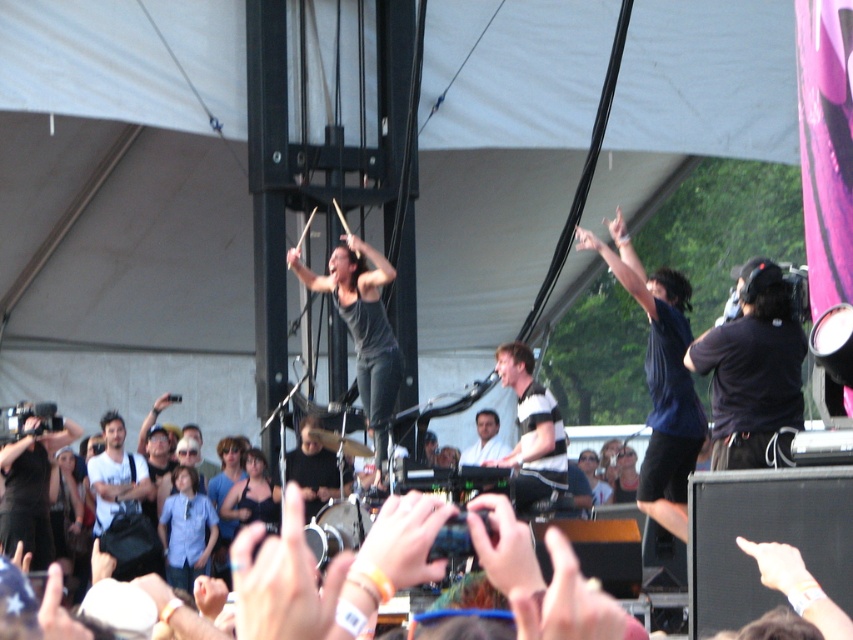
Question: Can you confirm if black camera at left is positioned above white matte shirt at center?

Choices:
 (A) no
 (B) yes

Answer: (B)

Question: Which of the following is the closest to the observer?

Choices:
 (A) black camera at left
 (B) smooth white shirt at center

Answer: (A)

Question: Which point appears farthest from the camera in this image?

Choices:
 (A) (189, 502)
 (B) (579, 241)

Answer: (A)

Question: Is striped cotton shirt at center closer to the viewer compared to black matte shirt at center?

Choices:
 (A) yes
 (B) no

Answer: (A)

Question: Which of the following is the closest to the observer?

Choices:
 (A) (412, 564)
 (B) (485, 433)
 (C) (769, 426)

Answer: (A)

Question: Does striped cotton shirt at center appear over smooth skin hand at upper center?

Choices:
 (A) yes
 (B) no

Answer: (B)